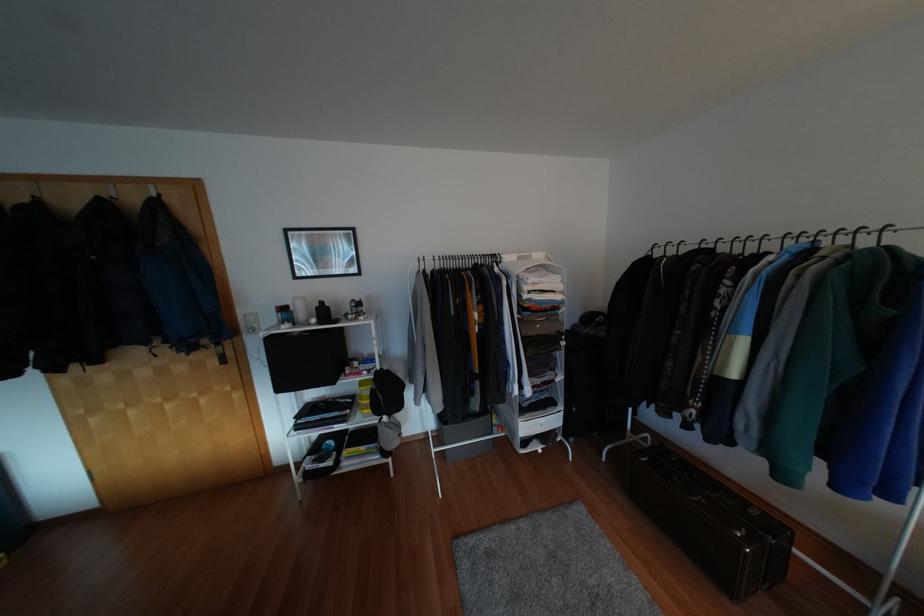
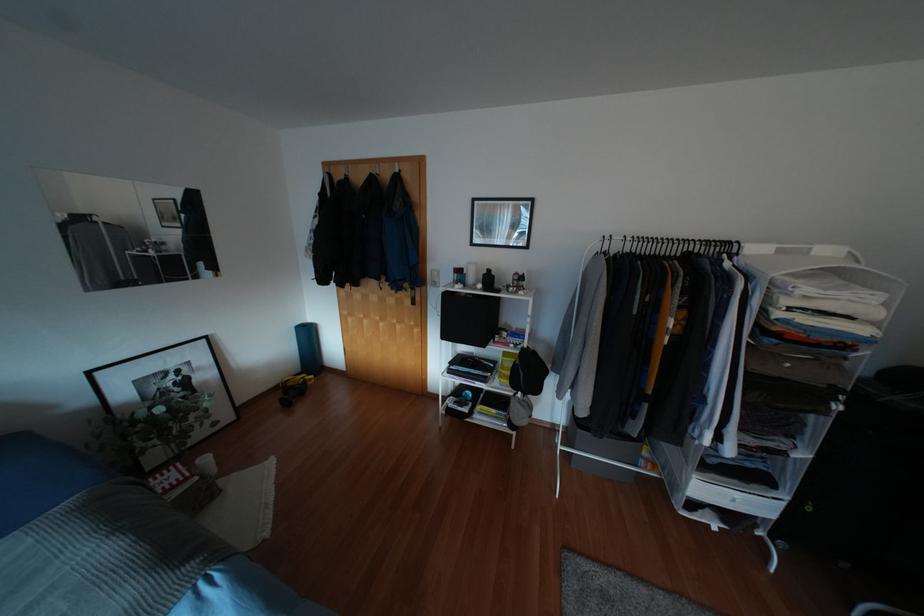
Find the pixel in the second image that matches the point at 517,257 in the first image.

(779, 251)